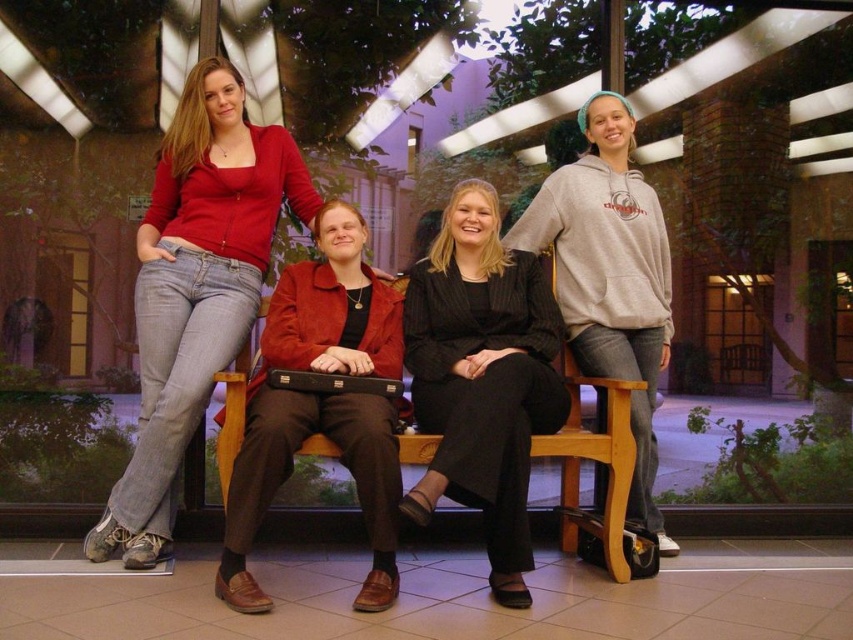
Does black pinstripe blazer at center have a larger size compared to black leather briefcase at center?

Yes, black pinstripe blazer at center is bigger than black leather briefcase at center.

Between black pinstripe blazer at center and black leather briefcase at center, which one appears on the left side from the viewer's perspective?

black leather briefcase at center

Between point (437, 278) and point (335, 385), which one is positioned behind?

The point (437, 278) is more distant.

Image resolution: width=853 pixels, height=640 pixels. What are the coordinates of `black pinstripe blazer at center` in the screenshot? It's located at (482, 378).

Who is taller, matte black briefcase at center or gray hoodie at center?

matte black briefcase at center is taller.

Can you confirm if matte black briefcase at center is thinner than gray hoodie at center?

No.

What do you see at coordinates (171, 394) in the screenshot? The height and width of the screenshot is (640, 853). I see `matte black briefcase at center` at bounding box center [171, 394].

Where is `matte black briefcase at center`? matte black briefcase at center is located at coordinates (x=171, y=394).

Does wooden bench at center have a larger size compared to black leather briefcase at center?

Yes, wooden bench at center is bigger than black leather briefcase at center.

Can you confirm if wooden bench at center is shorter than black leather briefcase at center?

No.

Does point (229, 380) lie in front of point (267, 381)?

Yes, it is in front of point (267, 381).

In order to click on wooden bench at center in this screenshot , I will do `click(593, 460)`.